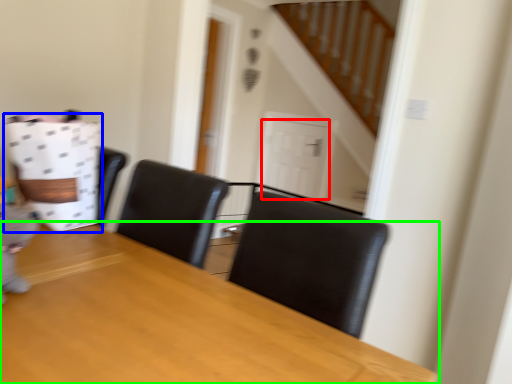
Question: Which object is positioned closest to door (highlighted by a red box)? Select from paper bag (highlighted by a blue box) and table (highlighted by a green box).

Choices:
 (A) paper bag
 (B) table

Answer: (A)